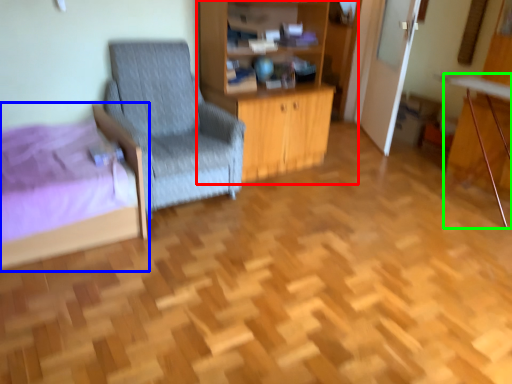
Question: Which is nearer to the dresser (highlighted by a red box)? bed (highlighted by a blue box) or computer desk (highlighted by a green box).

Choices:
 (A) bed
 (B) computer desk

Answer: (A)